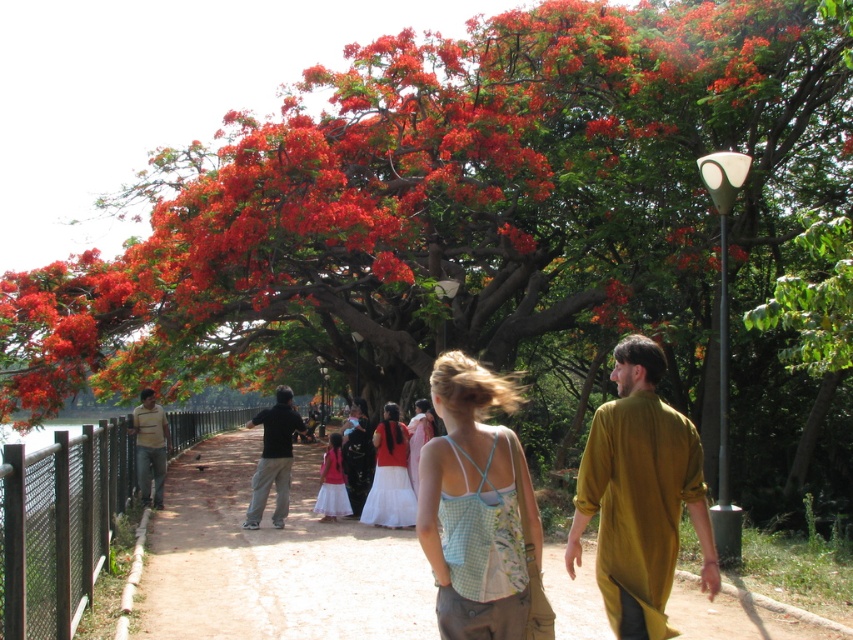
In the scene shown: Who is more distant from viewer, (386, 449) or (335, 465)?

Positioned behind is point (335, 465).

Does white cotton skirt at center appear over light blue cotton tank top at center?

No.

Between point (389, 440) and point (318, 476), which one is positioned in front?

Point (389, 440)

This screenshot has height=640, width=853. Find the location of `white cotton skirt at center`. white cotton skirt at center is located at coordinates (390, 476).

Which of these two, white cotton skirt at center or light brown cotton shirt at left, stands taller?

light brown cotton shirt at left is taller.

Between point (402, 445) and point (161, 468), which one is positioned behind?

Point (161, 468)

Which is in front, point (392, 467) or point (149, 486)?

Point (392, 467) is more forward.

Where is `white cotton skirt at center`? The image size is (853, 640). white cotton skirt at center is located at coordinates (390, 476).

Which is more to the right, light blue gingham tank top at center or light blue cotton tank top at center?

light blue gingham tank top at center

Between light blue gingham tank top at center and light blue cotton tank top at center, which one is positioned higher?

light blue gingham tank top at center is above.

Describe the element at coordinates (479, 509) in the screenshot. I see `light blue gingham tank top at center` at that location.

Identify the location of light blue gingham tank top at center. (479, 509).